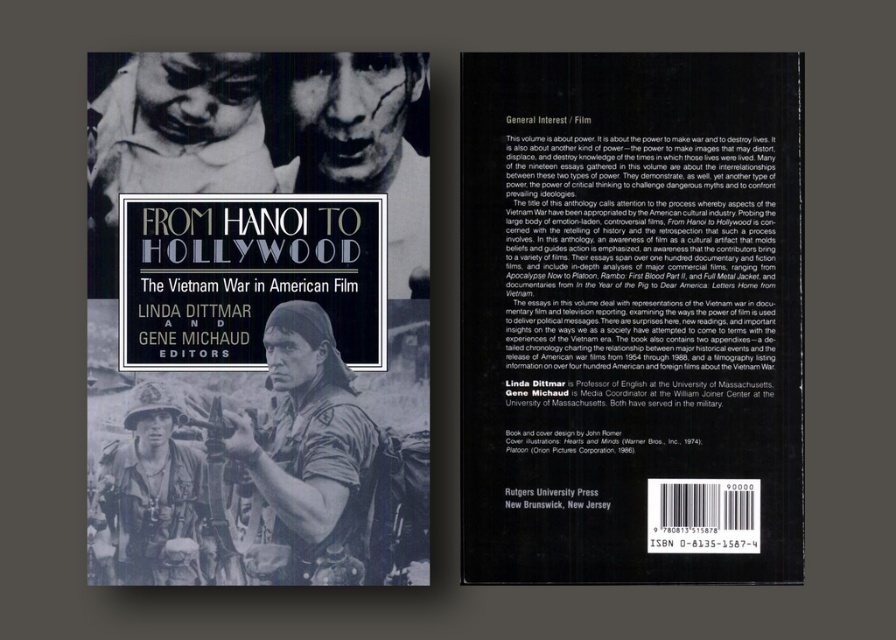
Question: Which point appears farthest from the camera in this image?

Choices:
 (A) (272, 424)
 (B) (371, 100)

Answer: (B)

Question: Which point is closer to the camera?

Choices:
 (A) grainy black-and-white soldier at center
 (B) black matte face at upper center
 (C) black matte book cover at upper center

Answer: (C)

Question: Which point is closer to the camera?

Choices:
 (A) pyautogui.click(x=131, y=396)
 (B) pyautogui.click(x=160, y=560)
 (C) pyautogui.click(x=290, y=577)

Answer: (B)

Question: Is grainy black-and-white photo of man at upper left above metallic helmet at lower left?

Choices:
 (A) no
 (B) yes

Answer: (B)

Question: Does grainy black-and-white soldier at center have a lesser width compared to grainy black-and-white photo of man at upper left?

Choices:
 (A) no
 (B) yes

Answer: (B)

Question: Can you confirm if black matte book cover at upper center is positioned below grainy black-and-white photo of man at upper left?

Choices:
 (A) yes
 (B) no

Answer: (A)